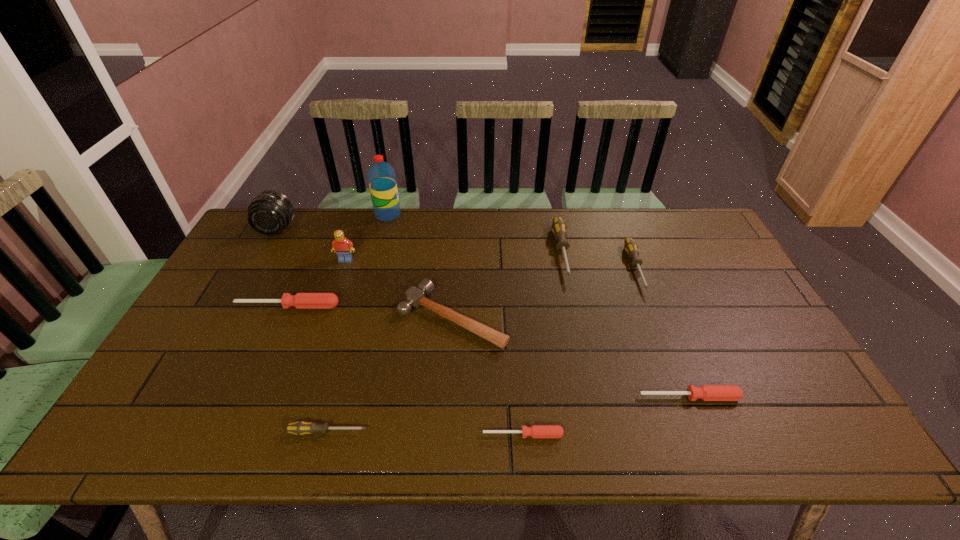
At what (x,y) coordinates should I click in order to perform the action: click on the third nearest screwdriver. Please return your answer as a coordinate pair (x, y). Image resolution: width=960 pixels, height=540 pixels. Looking at the image, I should click on (706, 392).

Identify the location of the second smallest red screwdriver. (706, 392).

At what (x,y) coordinates should I click in order to perform the action: click on the leftmost gray screwdriver. Please return your answer as a coordinate pair (x, y). This screenshot has width=960, height=540. Looking at the image, I should click on (299, 428).

Where is `the nearest gray screwdriver`? This screenshot has height=540, width=960. the nearest gray screwdriver is located at coordinates (299, 428).

The image size is (960, 540). I want to click on the second red screwdriver from left to right, so click(535, 431).

Find the location of `the shortest screwdriver`. the shortest screwdriver is located at coordinates (535, 431).

Find the location of a particular element. Image resolution: width=960 pixels, height=540 pixels. vacant space situated on the front label of the tallest object is located at coordinates (428, 215).

Locate an element on the screen. free space located 0.070m at the front element of the ninth shortest object is located at coordinates (264, 252).

At what (x,y) coordinates should I click in order to perform the action: click on vacant region located on the front-facing side of the third tallest object. Please return your answer as a coordinate pair (x, y). The image size is (960, 540). Looking at the image, I should click on pos(324,324).

The image size is (960, 540). What are the coordinates of `vacant region located 0.330m at the tip of the eighth object from left to right` in the screenshot? It's located at (588, 374).